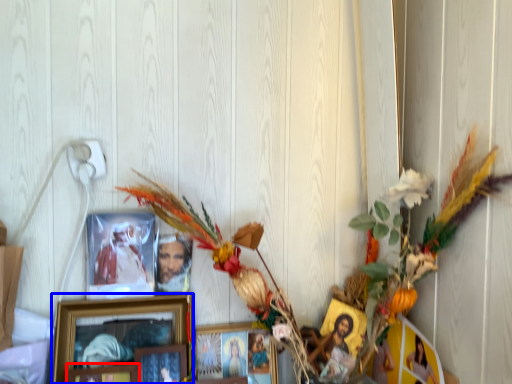
Question: Which of the following is the farthest to the observer, picture frame (highlighted by a red box) or picture frame (highlighted by a blue box)?

Choices:
 (A) picture frame
 (B) picture frame

Answer: (B)